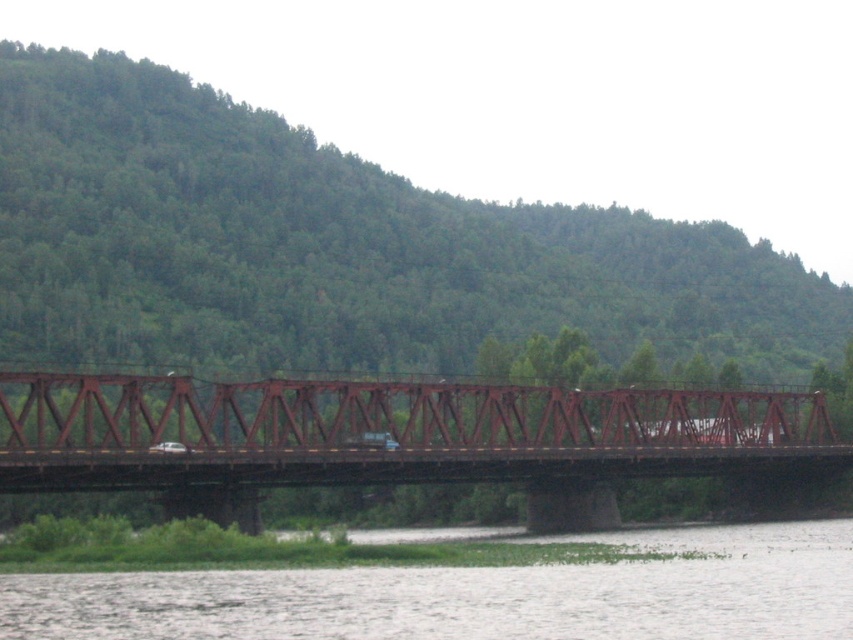
You are a drone operator planning to fly a drone over the red truss bridge in the image. The drone has a maximum flight radius of 100 meters from its starting point. If you start at the point marked as point (393, 438), will you be able to fly the drone to the far end of the bridge without exceeding the radius limit?

The point (393, 438) is where the rusty metal bridge at center is located. Since the drone can fly up to 100 meters from this starting point, and the bridge itself is likely shorter than 100 meters, the drone should be able to reach the far end without exceeding the radius limit.

You are a delivery truck driver planning to cross the rusty metal bridge at center. The truck requires a minimum clearance of 4 meters to safely pass under the white water at lower center. Based on the scene, can the truck safely cross the bridge without hitting the water?

The distance between the rusty metal bridge at center and the white water at lower center is 13.38 meters. Since the truck only needs 4 meters of clearance, there is ample space for the truck to safely cross the bridge without hitting the water.